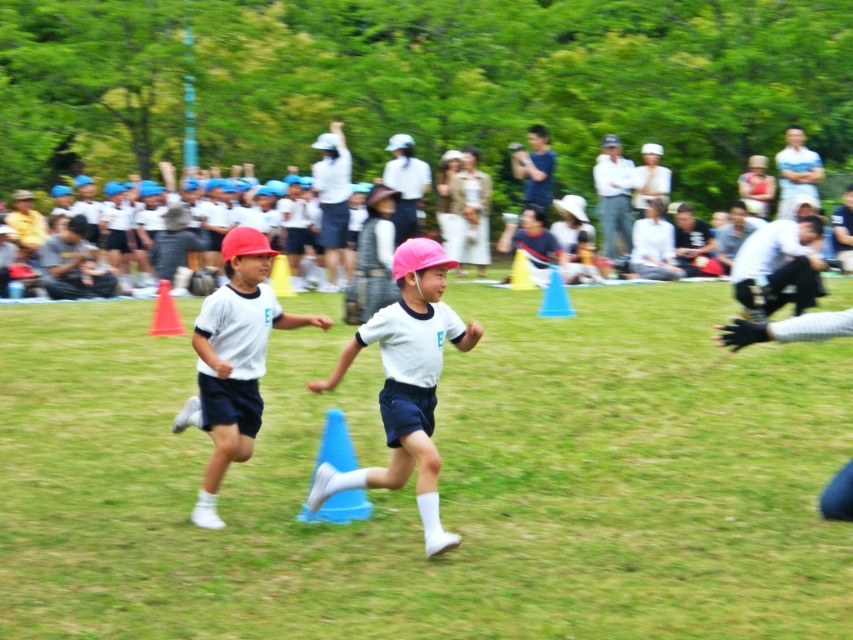
Consider the image. You are a photographer trying to capture a photo of the white matte shirt at center without the white cotton crowd at upper center blocking the view. Based on their heights, is this possible?

The white cotton crowd at upper center is much taller than the white matte shirt at center, so they would block the view of the white matte shirt at center. It might not be possible to capture a clear photo without obstruction.

You are a photographer at the event. You want to capture a photo that includes both the white cotton crowd at upper center and the white matte shirt at center. Which object should be placed higher in the frame to ensure both are visible?

To ensure both the white cotton crowd at upper center and the white matte shirt at center are visible in the photo, the white cotton crowd at upper center should be placed higher in the frame since it is located above the white matte shirt at center.